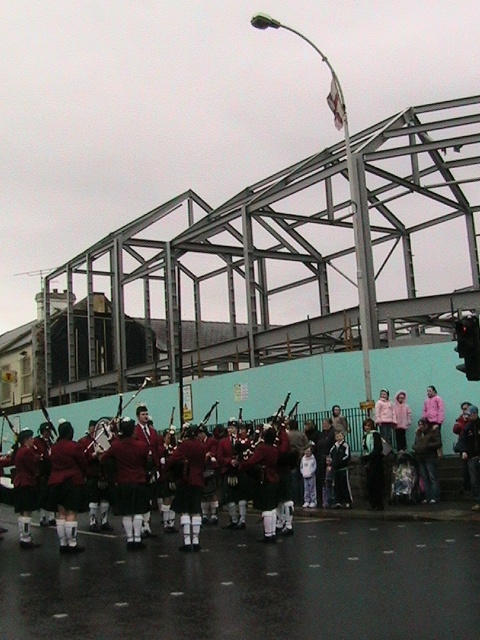
In the scene shown: Is maroon woolen kilt at center taller than shiny red bagpipes at center?

Incorrect, maroon woolen kilt at center's height is not larger of shiny red bagpipes at center's.

Who is more distant from viewer, (132, 480) or (118, 408)?

Positioned behind is point (118, 408).

This screenshot has height=640, width=480. I want to click on maroon woolen kilt at center, so click(x=129, y=480).

Which is below, shiny red bagpipes at center or pink fabric at center?

shiny red bagpipes at center

Can you confirm if shiny red bagpipes at center is smaller than pink fabric at center?

Incorrect, shiny red bagpipes at center is not smaller in size than pink fabric at center.

Measure the distance between point [118,428] and camera.

Point [118,428] and camera are 17.02 meters apart.

The width and height of the screenshot is (480, 640). I want to click on shiny red bagpipes at center, so click(x=109, y=426).

Is maroon woolen jackets at center to the right of brass shiny bagpipes at center from the viewer's perspective?

Indeed, maroon woolen jackets at center is positioned on the right side of brass shiny bagpipes at center.

Which of these two, maroon woolen jackets at center or brass shiny bagpipes at center, stands shorter?

brass shiny bagpipes at center is shorter.

Is point (450, 436) positioned before point (51, 426)?

No, it is not.

Locate an element on the screen. The height and width of the screenshot is (640, 480). maroon woolen jackets at center is located at coordinates (453, 440).